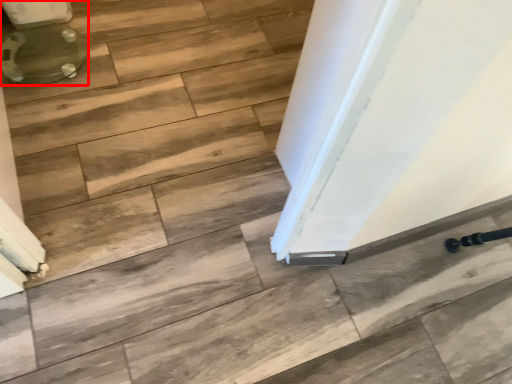
Question: From the image's perspective, what is the correct spatial relationship of toilet (annotated by the red box) in relation to stair?

Choices:
 (A) below
 (B) above

Answer: (B)